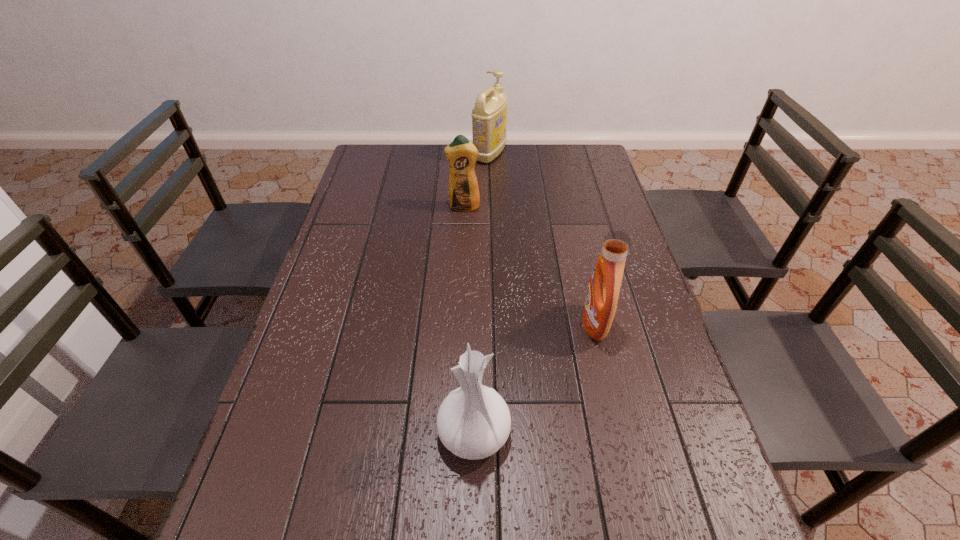
Locate an element on the screen. The height and width of the screenshot is (540, 960). the farthest detergent is located at coordinates (489, 116).

Locate an element on the screen. Image resolution: width=960 pixels, height=540 pixels. the nearest detergent is located at coordinates (603, 290).

You are a GUI agent. You are given a task and a screenshot of the screen. Output one action in this format:
    pyautogui.click(x=<x>, y=<y>)
    Task: Click on the rightmost object
    
    Given the screenshot: What is the action you would take?
    [x=603, y=290]

This screenshot has width=960, height=540. Identify the location of the second nearest detergent. (461, 154).

At what (x,y) coordinates should I click in order to perform the action: click on the nearest object. Please return your answer as a coordinate pair (x, y). Looking at the image, I should click on (473, 422).

Locate an element on the screen. The width and height of the screenshot is (960, 540). vacant space located on the right of the farthest detergent is located at coordinates (539, 155).

I want to click on vacant space situated on the front-facing side of the third farthest object, so click(515, 324).

I want to click on vacant point located on the front-facing side of the third farthest object, so click(491, 324).

Identify the location of vacant point located 0.320m on the front-facing side of the third farthest object. (454, 324).

I want to click on vacant space located on the label of the second farthest detergent, so click(460, 298).